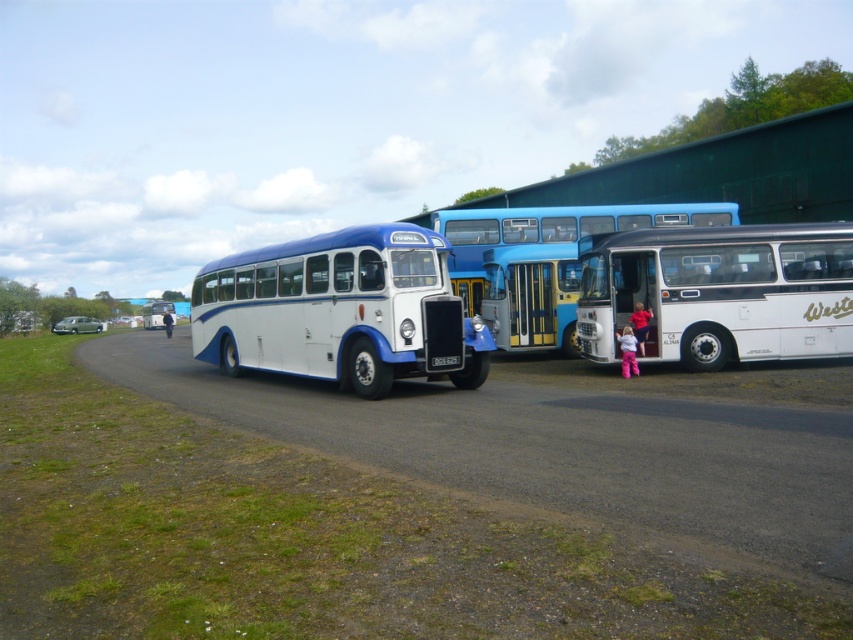
Question: Which point appears closest to the camera in this image?

Choices:
 (A) (589, 438)
 (B) (503, 240)
 (C) (248, 355)
 (D) (845, 234)

Answer: (A)

Question: Is matte white tour bus at center above white matte bus at center?

Choices:
 (A) no
 (B) yes

Answer: (B)

Question: Which is nearer to the blue metallic bus at center?

Choices:
 (A) dirt track at lower left
 (B) white matte bus at center

Answer: (B)

Question: Can you confirm if dirt track at lower left is thinner than matte white tour bus at center?

Choices:
 (A) no
 (B) yes

Answer: (A)

Question: Which object is positioned farthest from the dirt track at lower left?

Choices:
 (A) white matte bus at center
 (B) blue metallic bus at center

Answer: (B)

Question: Does matte white tour bus at center appear on the left side of blue metallic bus at center?

Choices:
 (A) no
 (B) yes

Answer: (B)